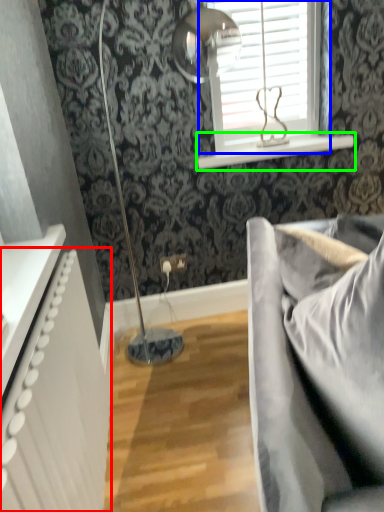
Question: Which is nearer to the radiator (highlighted by a red box)? window (highlighted by a blue box) or window sill (highlighted by a green box).

Choices:
 (A) window
 (B) window sill

Answer: (B)